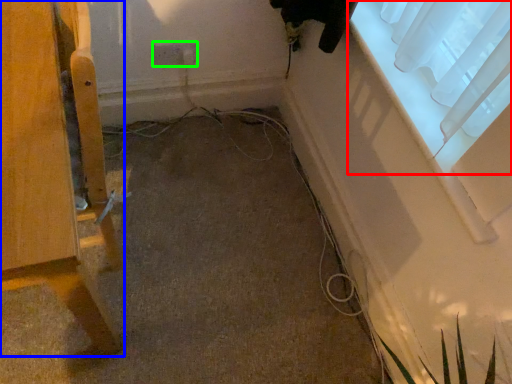
Question: Estimate the real-world distances between objects in this image. Which object is closer to window (highlighted by a red box), furniture (highlighted by a blue box) or electric outlet (highlighted by a green box)?

Choices:
 (A) furniture
 (B) electric outlet

Answer: (B)